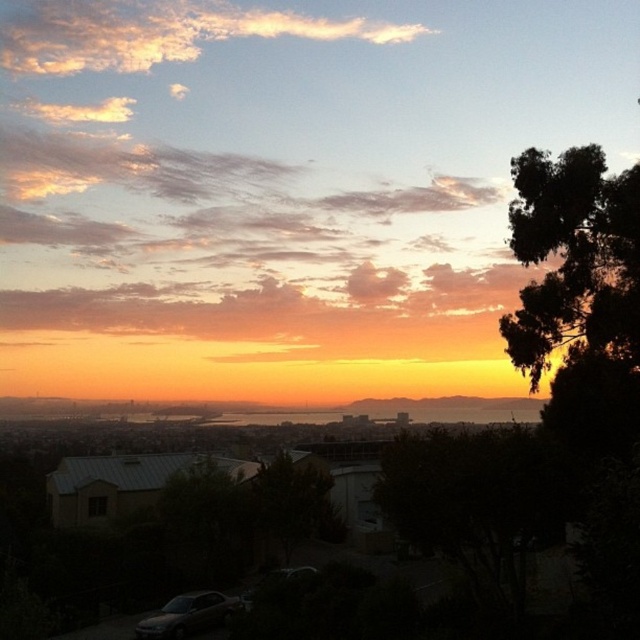
Question: Observing the image, what is the correct spatial positioning of green leafy tree at center in reference to matte silver car at lower left?

Choices:
 (A) left
 (B) right

Answer: (B)

Question: Is green leafy tree at center above matte silver car at lower left?

Choices:
 (A) no
 (B) yes

Answer: (B)

Question: Among these points, which one is farthest from the camera?

Choices:
 (A) (173, 630)
 (B) (296, 477)

Answer: (B)

Question: Among these objects, which one is farthest from the camera?

Choices:
 (A) matte silver car at lower left
 (B) green leafy tree at center

Answer: (B)

Question: Can you confirm if green leafy tree at center is positioned to the left of matte silver car at lower left?

Choices:
 (A) no
 (B) yes

Answer: (A)